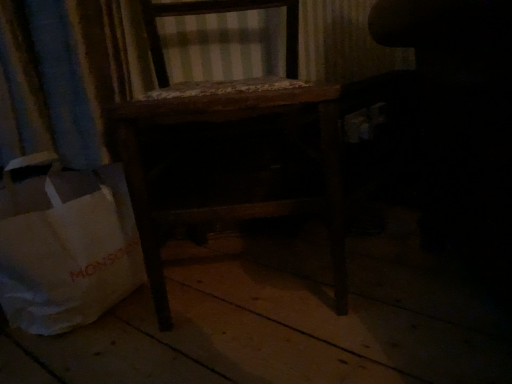
Question: From a real-world perspective, is wooden chair at center over white paper bag at lower left?

Choices:
 (A) no
 (B) yes

Answer: (B)

Question: Does wooden chair at center have a lesser height compared to white paper bag at lower left?

Choices:
 (A) yes
 (B) no

Answer: (B)

Question: From the image's perspective, is wooden chair at center on white paper bag at lower left?

Choices:
 (A) no
 (B) yes

Answer: (B)

Question: Is wooden chair at center thinner than white paper bag at lower left?

Choices:
 (A) no
 (B) yes

Answer: (A)

Question: Does wooden chair at center touch white paper bag at lower left?

Choices:
 (A) no
 (B) yes

Answer: (A)

Question: Is white paper bag at lower left inside or outside of dark fabric swivel chair at right?

Choices:
 (A) inside
 (B) outside

Answer: (B)

Question: Looking at their shapes, would you say white paper bag at lower left is wider or thinner than dark fabric swivel chair at right?

Choices:
 (A) thin
 (B) wide

Answer: (A)

Question: Does point (53, 180) appear closer or farther from the camera than point (434, 23)?

Choices:
 (A) closer
 (B) farther

Answer: (B)

Question: Looking at the image, does white paper bag at lower left seem bigger or smaller compared to dark fabric swivel chair at right?

Choices:
 (A) small
 (B) big

Answer: (A)

Question: Would you say dark fabric swivel chair at right is to the left or to the right of wooden chair at center in the picture?

Choices:
 (A) right
 (B) left

Answer: (A)

Question: Considering their positions, is dark fabric swivel chair at right located in front of or behind wooden chair at center?

Choices:
 (A) front
 (B) behind

Answer: (B)

Question: From the image's perspective, relative to wooden chair at center, is dark fabric swivel chair at right above or below?

Choices:
 (A) above
 (B) below

Answer: (A)

Question: From a real-world perspective, is dark fabric swivel chair at right positioned above or below wooden chair at center?

Choices:
 (A) above
 (B) below

Answer: (A)

Question: In the image, is dark fabric swivel chair at right on the left side or the right side of white paper bag at lower left?

Choices:
 (A) right
 (B) left

Answer: (A)

Question: Which is correct: dark fabric swivel chair at right is inside white paper bag at lower left, or outside of it?

Choices:
 (A) inside
 (B) outside

Answer: (B)